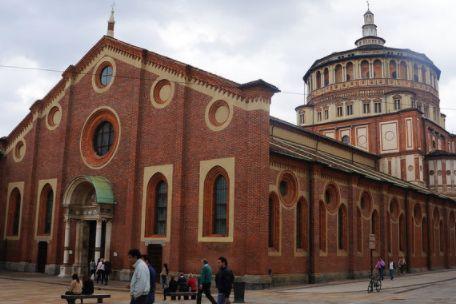
Where is `bench`? This screenshot has width=456, height=304. bench is located at coordinates (83, 295).